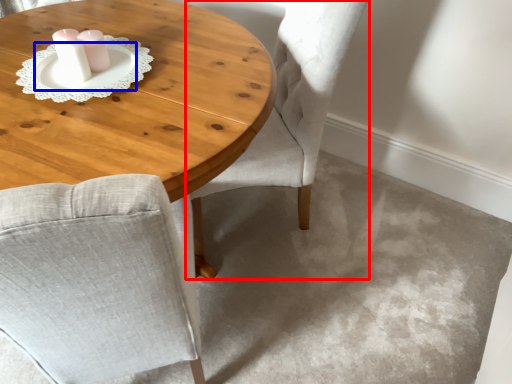
Question: Which point is closer to the camera, chair (highlighted by a red box) or saucer (highlighted by a blue box)?

Choices:
 (A) chair
 (B) saucer

Answer: (A)